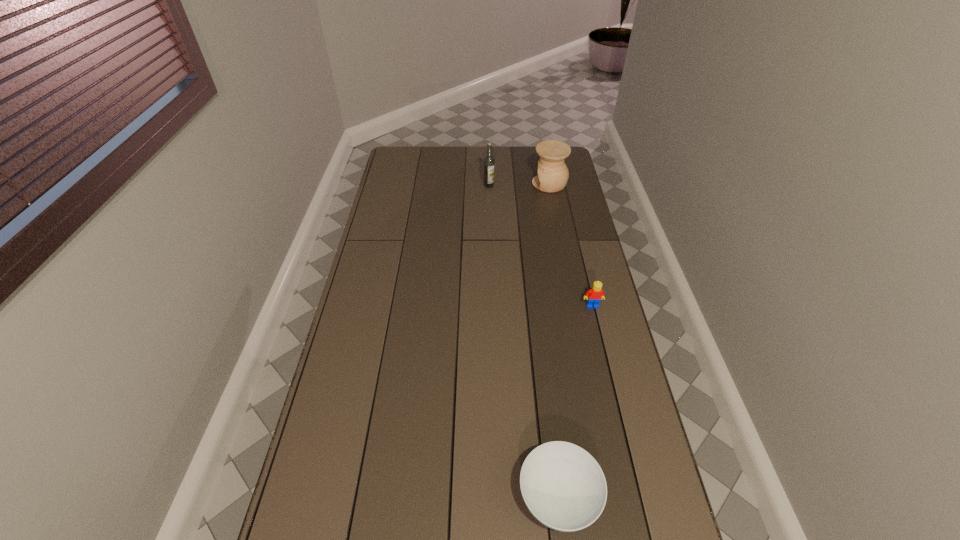
I want to click on vodka, so click(x=489, y=161).

You are a GUI agent. You are given a task and a screenshot of the screen. Output one action in this format:
    pyautogui.click(x=<x>, y=<y>)
    Task: Click on the tallest object
    
    Given the screenshot: What is the action you would take?
    pyautogui.click(x=489, y=161)

Where is `the second tallest object`? the second tallest object is located at coordinates (553, 174).

Where is `the third farthest object`? the third farthest object is located at coordinates (594, 295).

Where is `vacant space situated on the label of the vodka`? vacant space situated on the label of the vodka is located at coordinates (490, 201).

Find the location of a particular element. vacant space situated 0.130m at the open side of the pottery is located at coordinates (505, 184).

Find the location of a particular element. This screenshot has width=960, height=540. vacant space positioned 0.090m at the open side of the pottery is located at coordinates (513, 184).

At what (x,y) coordinates should I click in order to perform the action: click on free point located 0.130m at the open side of the pottery. Please return your answer as a coordinate pair (x, y). Image resolution: width=960 pixels, height=540 pixels. Looking at the image, I should click on (505, 184).

The width and height of the screenshot is (960, 540). Find the location of `vacant region located 0.100m on the face of the Lego`. vacant region located 0.100m on the face of the Lego is located at coordinates pos(598,332).

This screenshot has width=960, height=540. I want to click on pottery present at the right edge, so click(553, 174).